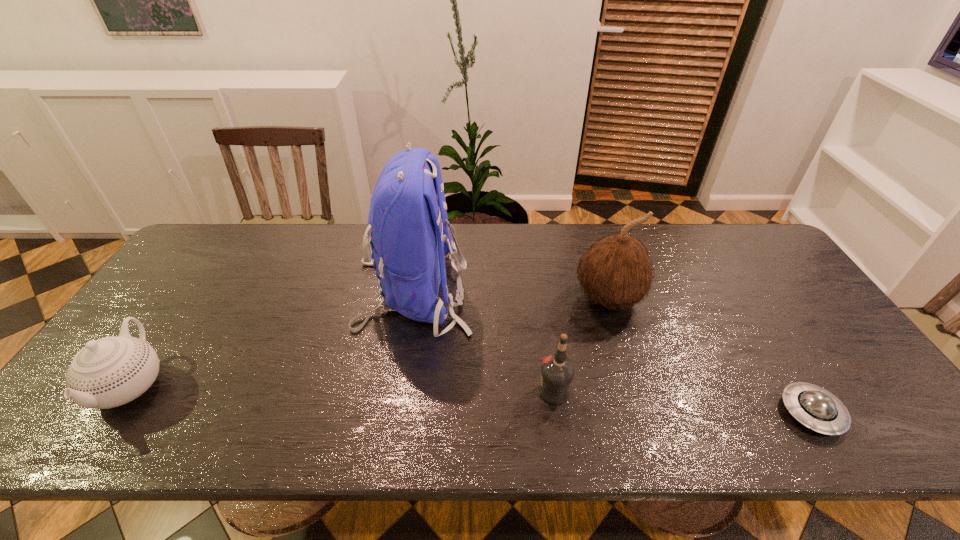
The image size is (960, 540). Identify the location of free space located on the back of the second object from left to right. (544, 292).

In order to click on vacant area situated 0.080m on the surface of the coconut in this screenshot , I will do `click(623, 349)`.

Locate an element on the screen. free location located 0.380m on the front label of the vodka is located at coordinates (377, 390).

Locate an element on the screen. vacant region located on the front label of the vodka is located at coordinates (373, 390).

The image size is (960, 540). I want to click on free spot located on the front label of the vodka, so click(415, 390).

This screenshot has height=540, width=960. Find the location of `free space located on the back of the rightmost object`. free space located on the back of the rightmost object is located at coordinates (764, 336).

Where is `object at the far edge`? The image size is (960, 540). object at the far edge is located at coordinates (408, 237).

Locate an element on the screen. Image resolution: width=960 pixels, height=540 pixels. chinaware at the near edge is located at coordinates (109, 372).

At what (x,y) coordinates should I click in order to perform the action: click on saucer located in the near edge section of the desktop. Please return your answer as a coordinate pair (x, y). Looking at the image, I should click on (x=816, y=408).

This screenshot has width=960, height=540. What are the coordinates of `object that is at the left edge` in the screenshot? It's located at (109, 372).